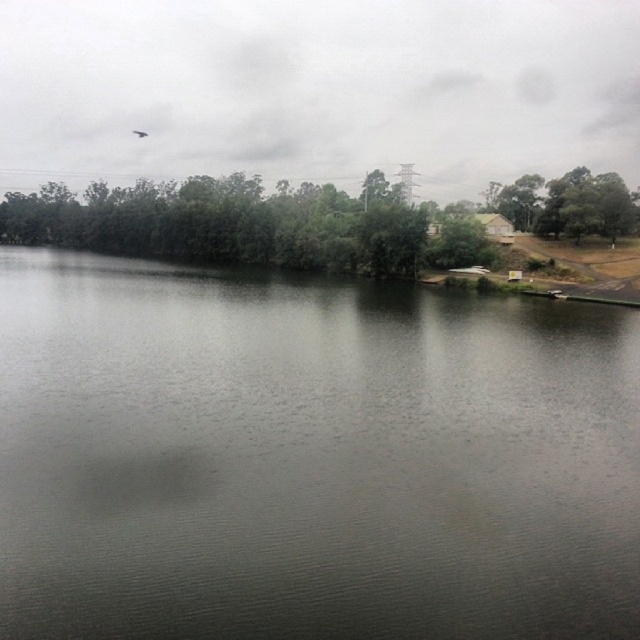
You are standing on the shore looking out at the scene. Which tree is closer to the center of the image, the green leafy trees at center or the green matte tree at upper right?

The green leafy trees at center are closer to the center of the image than the green matte tree at upper right, as they are positioned to the left of it.

You are an environmental scientist assessing the scene. You need to determine which object occupies a larger area in the image between the dark gray water at center and the green matte tree at upper right. Based on the scene description, which one is larger?

The green matte tree at upper right is larger than the dark gray water at center in the image.